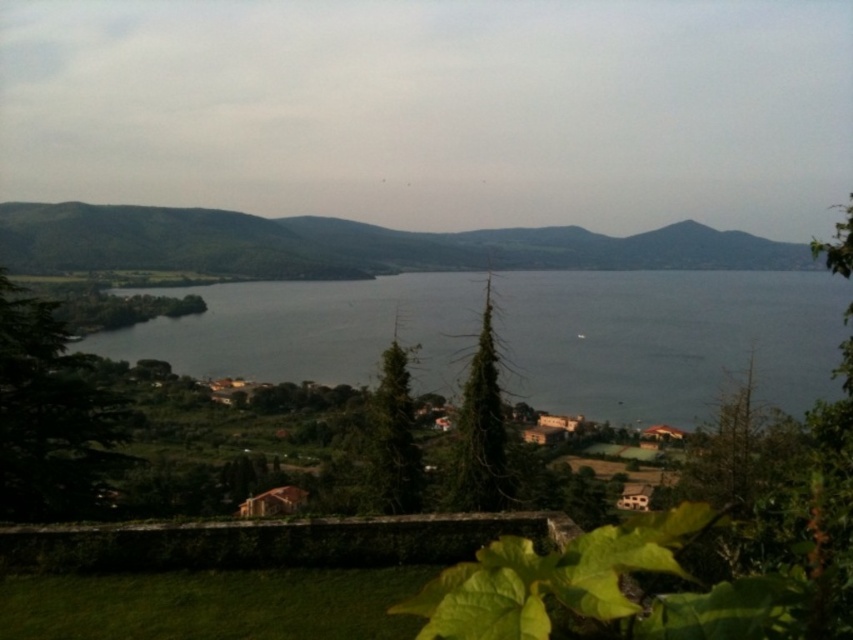
Question: Which point is closer to the camera?

Choices:
 (A) (527, 228)
 (B) (389, 282)

Answer: (B)

Question: Which point is farther to the camera?

Choices:
 (A) green matte mountain at center
 (B) gray water at center

Answer: (A)

Question: Is gray water at center thinner than green matte mountain at center?

Choices:
 (A) no
 (B) yes

Answer: (B)

Question: In this image, where is gray water at center located relative to green matte mountain at center?

Choices:
 (A) left
 (B) right

Answer: (B)

Question: Is gray water at center to the right of green matte mountain at center from the viewer's perspective?

Choices:
 (A) no
 (B) yes

Answer: (B)